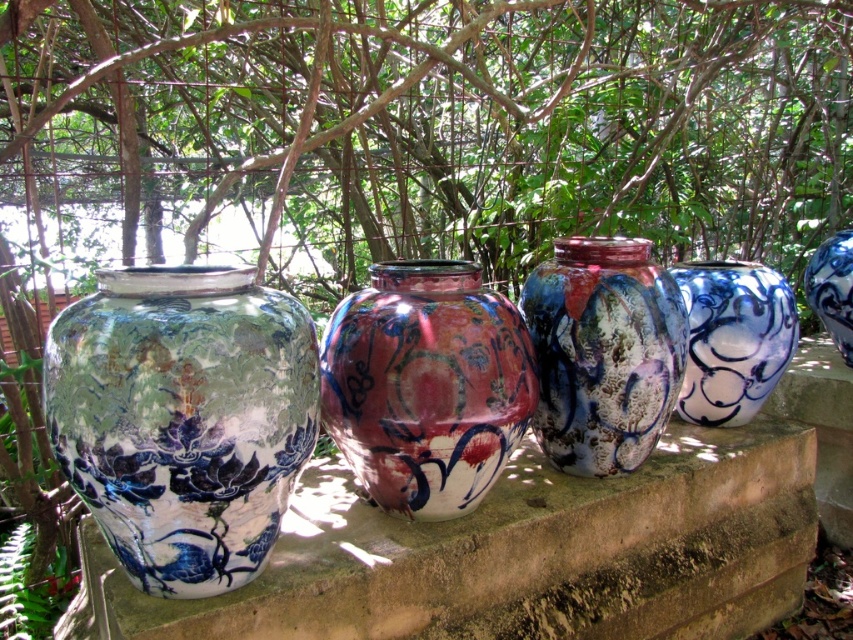
Between point (392, 456) and point (762, 264), which one is positioned behind?

Point (762, 264)

Between shiny ceramic vase at center and blue glossy jar at right, which one is positioned higher?

blue glossy jar at right

Is point (335, 392) positioned after point (784, 340)?

No, it is in front of (784, 340).

This screenshot has width=853, height=640. Find the location of `shiny ceramic vase at center`. shiny ceramic vase at center is located at coordinates (426, 385).

Can you confirm if blue and white glazed vase at left is wider than marbled ceramic vase at center?

Yes.

The height and width of the screenshot is (640, 853). Describe the element at coordinates (183, 419) in the screenshot. I see `blue and white glazed vase at left` at that location.

Does point (102, 499) come farther from viewer compared to point (569, 403)?

No, (102, 499) is closer to viewer.

Find the location of a particular element. blue and white glazed vase at left is located at coordinates (183, 419).

From the picture: Does shiny ceramic vase at center have a smaller size compared to blue glossy jar at upper right?

Incorrect, shiny ceramic vase at center is not smaller in size than blue glossy jar at upper right.

The image size is (853, 640). What are the coordinates of `shiny ceramic vase at center` in the screenshot? It's located at (426, 385).

Identify the location of shiny ceramic vase at center. Image resolution: width=853 pixels, height=640 pixels. (426, 385).

Where is `shiny ceramic vase at center`? The height and width of the screenshot is (640, 853). shiny ceramic vase at center is located at coordinates (426, 385).